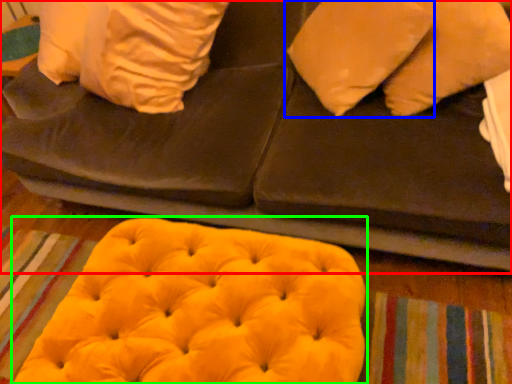
Question: Considering the real-world distances, which object is farthest from furniture (highlighted by a red box)? pillow (highlighted by a blue box) or bean bag chair (highlighted by a green box)?

Choices:
 (A) pillow
 (B) bean bag chair

Answer: (B)